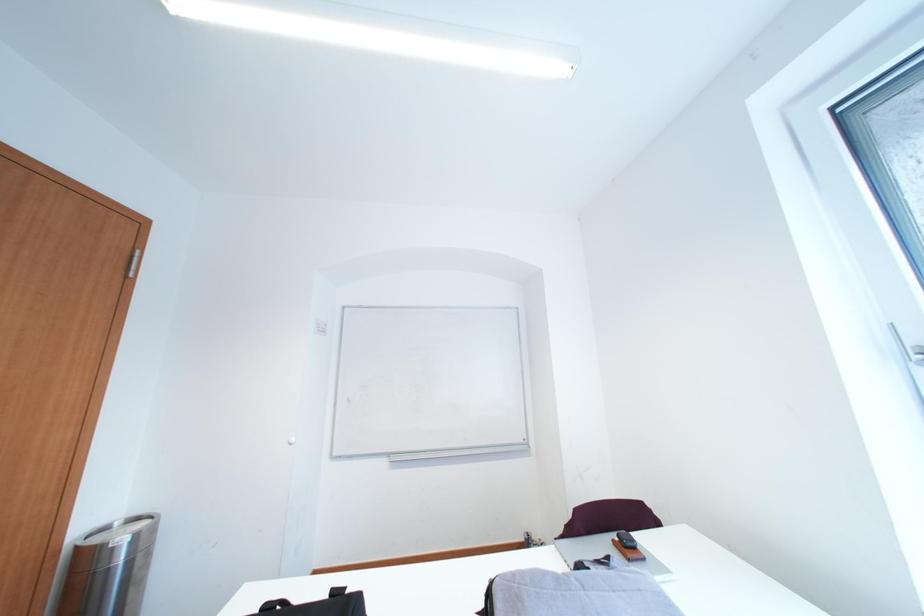
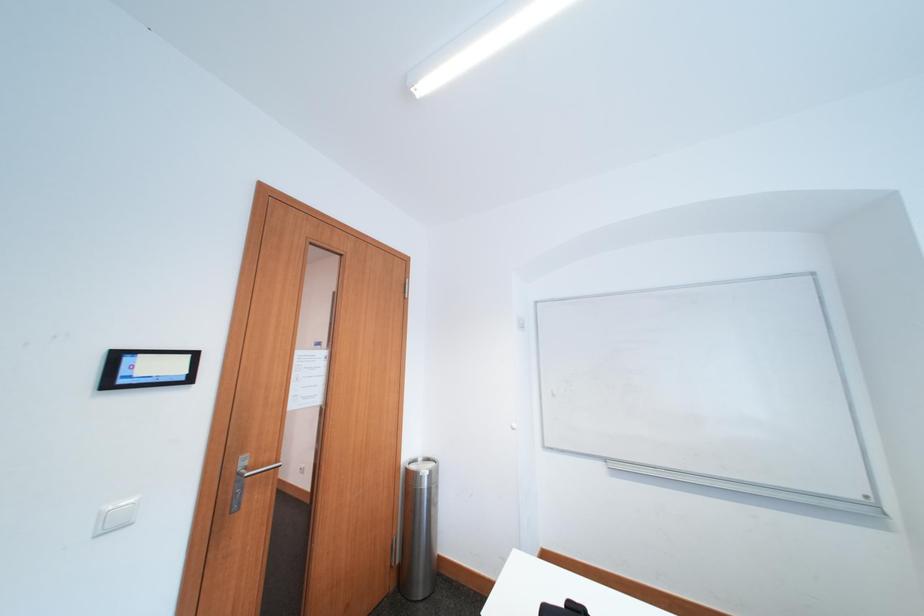
Question: The camera is either moving clockwise (left) or counter-clockwise (right) around the object. The first image is from the beginning of the video and the second image is from the end. Is the camera moving left or right when shooting the video?

Choices:
 (A) Left
 (B) Right

Answer: (B)